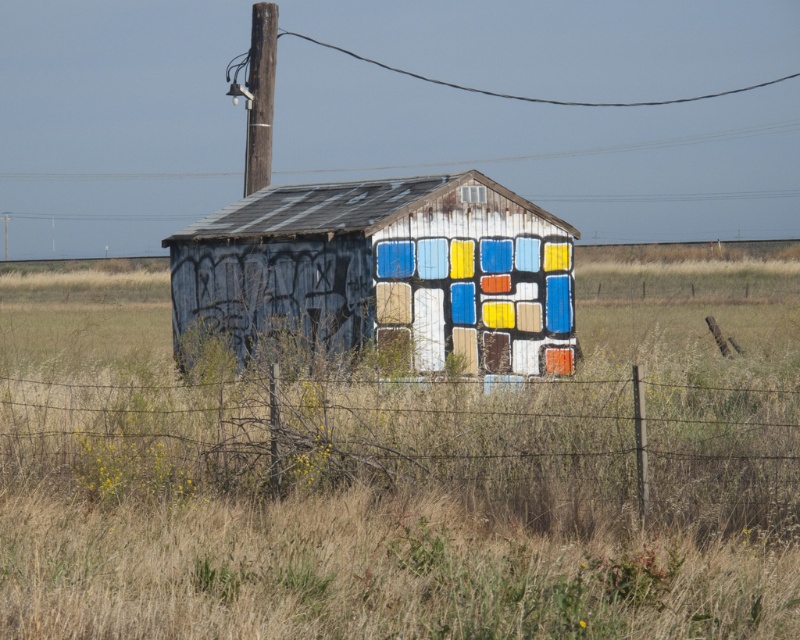
Which is more to the left, brown wooden telegraph pole at upper center or transparent plastic window at upper center?

brown wooden telegraph pole at upper center is more to the left.

Is brown wooden telegraph pole at upper center above transparent plastic window at upper center?

Correct, brown wooden telegraph pole at upper center is located above transparent plastic window at upper center.

Which is in front, point (264, 8) or point (458, 189)?

Point (458, 189) is in front.

The image size is (800, 640). In order to click on brown wooden telegraph pole at upper center in this screenshot , I will do `click(260, 97)`.

Does wire mesh at lower center appear over brown wooden telegraph pole at upper center?

No.

Based on the photo, measure the distance between wire mesh at lower center and brown wooden telegraph pole at upper center.

The distance of wire mesh at lower center from brown wooden telegraph pole at upper center is 27.45 meters.

Identify the location of wire mesh at lower center. The image size is (800, 640). coord(468,442).

Locate an element on the screen. The height and width of the screenshot is (640, 800). wire mesh at lower center is located at coordinates (468, 442).

Can you confirm if painted wood hut at center is taller than transparent plastic window at upper center?

Yes.

Who is more distant from viewer, (276, 300) or (468, 196)?

The point (276, 300) is more distant.

The width and height of the screenshot is (800, 640). What are the coordinates of `painted wood hut at center` in the screenshot? It's located at (384, 273).

This screenshot has width=800, height=640. Find the location of `painted wood hut at center`. painted wood hut at center is located at coordinates (384, 273).